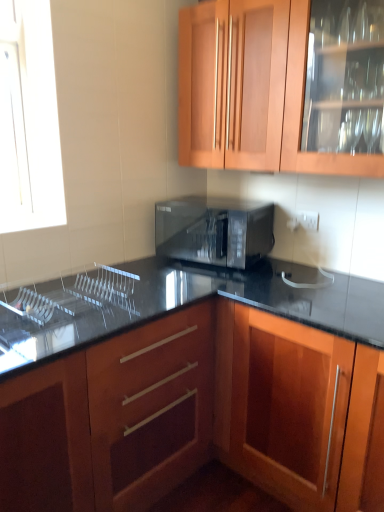
Question: Which direction should I rotate to face wooden cabinet at upper center, the second cabinetry in the bottom-to-top sequence, — up or down?

Choices:
 (A) up
 (B) down

Answer: (A)

Question: Is black glossy microwave at center completely or partially inside wooden cabinet at upper center, the 1th cabinetry positioned from the top?

Choices:
 (A) no
 (B) yes

Answer: (A)

Question: From the image's perspective, is wooden cabinet at upper center, the second cabinetry in the bottom-to-top sequence, on black glossy microwave at center?

Choices:
 (A) yes
 (B) no

Answer: (A)

Question: From a real-world perspective, is wooden cabinet at upper center, the 1th cabinetry positioned from the top, positioned under black glossy microwave at center based on gravity?

Choices:
 (A) no
 (B) yes

Answer: (A)

Question: Can you confirm if wooden cabinet at upper center, the second cabinetry in the bottom-to-top sequence, is smaller than black glossy microwave at center?

Choices:
 (A) no
 (B) yes

Answer: (A)

Question: Is wooden cabinet at upper center, the 1th cabinetry positioned from the top, further to camera compared to black glossy microwave at center?

Choices:
 (A) yes
 (B) no

Answer: (B)

Question: From the image's perspective, does wooden cabinet at upper center, the second cabinetry in the bottom-to-top sequence, appear lower than black glossy microwave at center?

Choices:
 (A) no
 (B) yes

Answer: (A)

Question: Is the depth of wooden cabinet at upper center, the 1th cabinetry positioned from the top, greater than that of wooden cabinet at center, which ranks as the 1th cabinetry in bottom-to-top order?

Choices:
 (A) yes
 (B) no

Answer: (A)

Question: From a real-world perspective, is wooden cabinet at upper center, the 1th cabinetry positioned from the top, physically below wooden cabinet at center, which ranks as the 1th cabinetry in bottom-to-top order?

Choices:
 (A) yes
 (B) no

Answer: (B)

Question: From the image's perspective, would you say wooden cabinet at upper center, the second cabinetry in the bottom-to-top sequence, is shown under wooden cabinet at center, which ranks as the 1th cabinetry in bottom-to-top order?

Choices:
 (A) yes
 (B) no

Answer: (B)

Question: Could you tell me if wooden cabinet at upper center, the second cabinetry in the bottom-to-top sequence, is facing wooden cabinet at center, which is counted as the second cabinetry, starting from the top?

Choices:
 (A) no
 (B) yes

Answer: (A)

Question: Does wooden cabinet at upper center, the 1th cabinetry positioned from the top, lie in front of wooden cabinet at center, which is counted as the second cabinetry, starting from the top?

Choices:
 (A) yes
 (B) no

Answer: (B)

Question: Is wooden cabinet at upper center, the second cabinetry in the bottom-to-top sequence, beside wooden cabinet at center, which is counted as the second cabinetry, starting from the top?

Choices:
 (A) no
 (B) yes

Answer: (A)

Question: Is wooden cabinet at center, which ranks as the 1th cabinetry in bottom-to-top order, to the left of clear glass sink at lower left from the viewer's perspective?

Choices:
 (A) yes
 (B) no

Answer: (B)